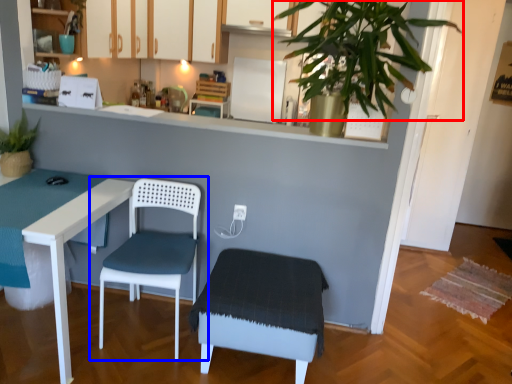
Question: Which point is closer to the camera, vegetation (highlighted by a red box) or chair (highlighted by a blue box)?

Choices:
 (A) vegetation
 (B) chair

Answer: (A)